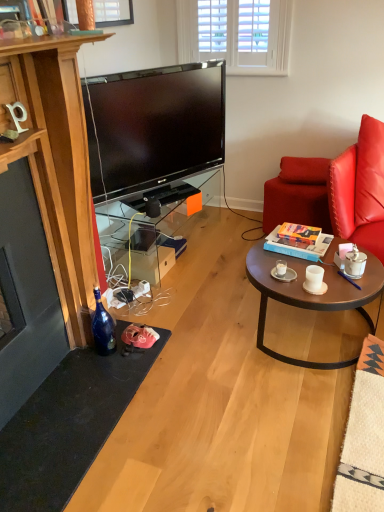
Where is `free spot to the left of white matte coffee cup at center right, placed as the 2th coffee cup when sorted from right to left`? Image resolution: width=384 pixels, height=512 pixels. free spot to the left of white matte coffee cup at center right, placed as the 2th coffee cup when sorted from right to left is located at coordinates (283, 283).